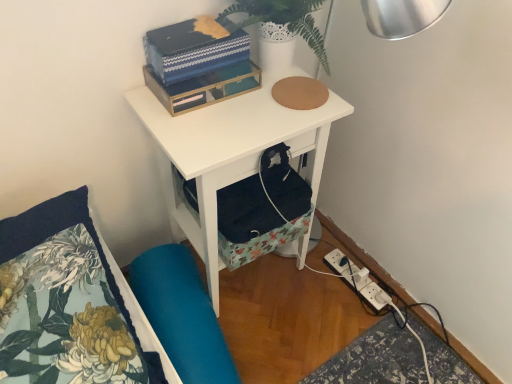
Find the location of a particular element. This screenshot has width=512, height=384. free space in front of white textured vase at upper center is located at coordinates (252, 117).